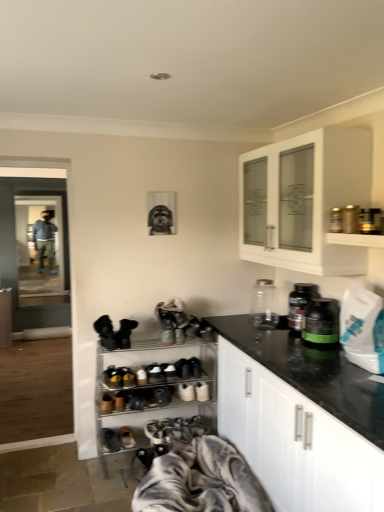
Locate an element on the screen. This screenshot has height=512, width=384. vacant space to the left of green plastic container at upper right is located at coordinates (285, 343).